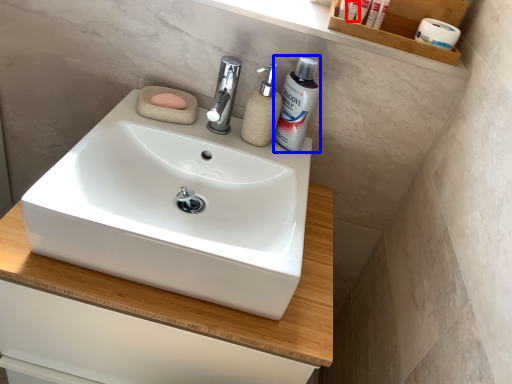
Question: Which of the following is the farthest to the observer, toiletry (highlighted by a red box) or shaving cream (highlighted by a blue box)?

Choices:
 (A) toiletry
 (B) shaving cream

Answer: (A)